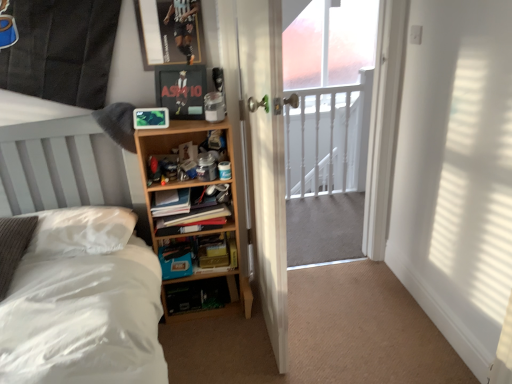
Question: From the image's perspective, is matte black picture frame at upper center, which is counted as the first picture frame, starting from the bottom, positioned above or below wooden bookshelf at center?

Choices:
 (A) below
 (B) above

Answer: (B)

Question: Considering their positions, is matte black picture frame at upper center, which is counted as the first picture frame, starting from the bottom, located in front of or behind wooden bookshelf at center?

Choices:
 (A) behind
 (B) front

Answer: (B)

Question: Based on their relative distances, which object is nearer to the hardcover book at center?

Choices:
 (A) white soft bed at left
 (B) wooden shelf at center
 (C) matte black picture frame at upper center, which is counted as the first picture frame, starting from the bottom
 (D) clear glass screen door at center
 (E) white wooden door at center

Answer: (B)

Question: Which object is positioned farthest from the white glossy railings at center?

Choices:
 (A) wooden bookshelf at center
 (B) white wooden door at center
 (C) matte black picture frame at upper center, the 2th picture frame positioned from the top
 (D) metallic silver picture frame at upper center, the first picture frame viewed from the top
 (E) clear glass screen door at center

Answer: (D)